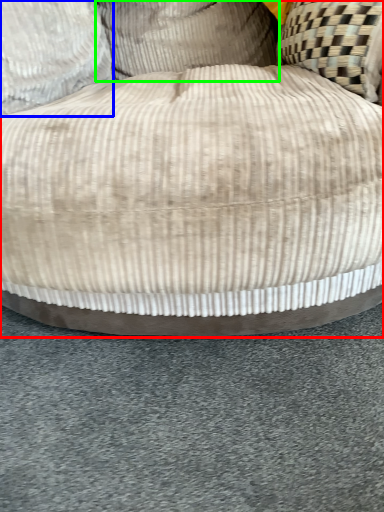
Question: Which object is the farthest from furniture (highlighted by a red box)? Choose among these: pillow (highlighted by a blue box) or pillow (highlighted by a green box).

Choices:
 (A) pillow
 (B) pillow

Answer: (B)